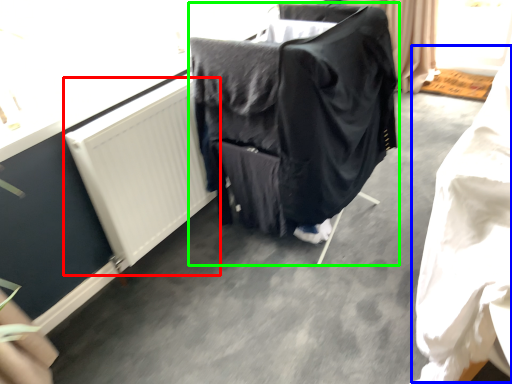
Question: Estimate the real-world distances between objects in this image. Which object is closer to radiator (highlighted by a red box), clothing (highlighted by a blue box) or furniture (highlighted by a green box)?

Choices:
 (A) clothing
 (B) furniture

Answer: (B)